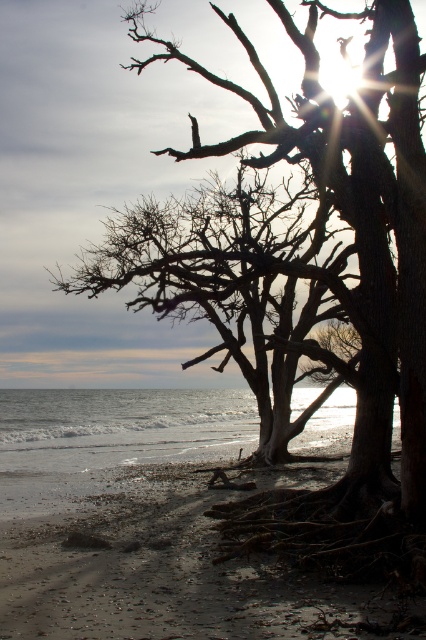
Which of these two, dull gray sand at lower center or clear water at lower left, stands shorter?

dull gray sand at lower center is shorter.

Does dull gray sand at lower center have a lesser width compared to clear water at lower left?

Yes, dull gray sand at lower center is thinner than clear water at lower left.

I want to click on dull gray sand at lower center, so click(173, 577).

Does dull gray sand at lower center have a lesser width compared to silhouette bark tree at center?

Correct, dull gray sand at lower center's width is less than silhouette bark tree at center's.

Who is more forward, (279, 620) or (204, 288)?

Point (279, 620) is more forward.

At what (x,y) coordinates should I click in order to perform the action: click on dull gray sand at lower center. Please return your answer as a coordinate pair (x, y). This screenshot has width=426, height=640. Looking at the image, I should click on (173, 577).

Who is positioned more to the right, silhouette bark tree at center or clear water at lower left?

silhouette bark tree at center

Consider the image. Can you confirm if silhouette bark tree at center is positioned below clear water at lower left?

Actually, silhouette bark tree at center is above clear water at lower left.

The height and width of the screenshot is (640, 426). In order to click on silhouette bark tree at center in this screenshot , I will do `click(230, 282)`.